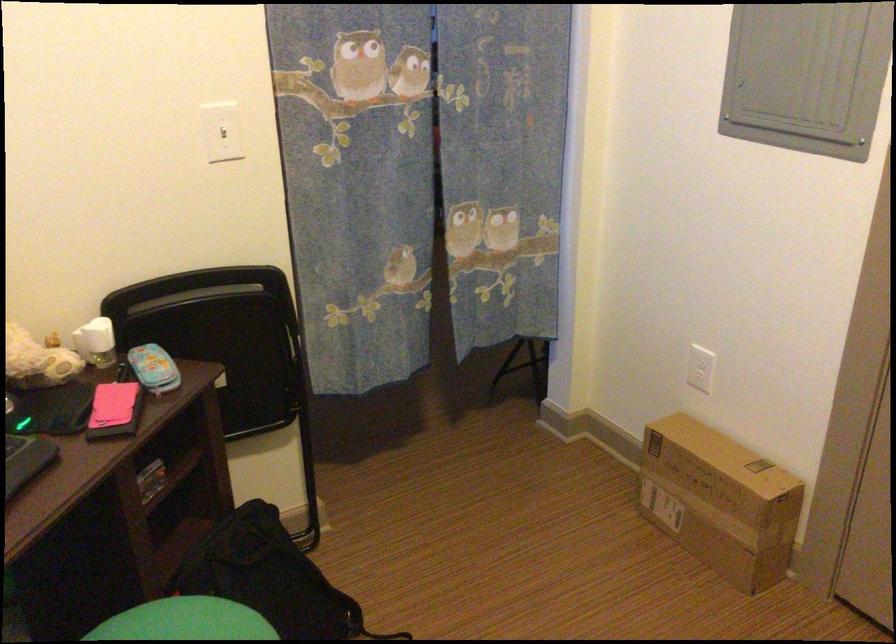
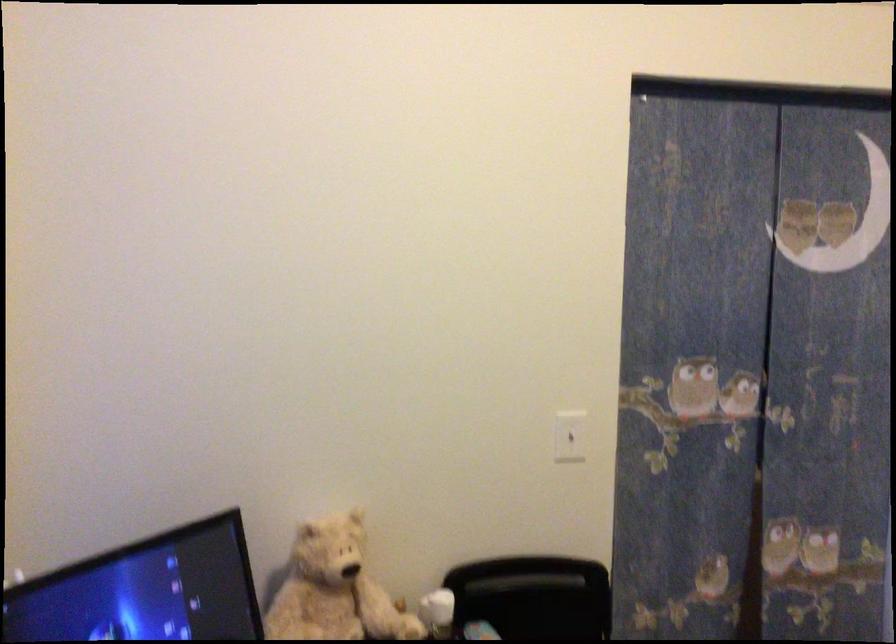
In a continuous first-person perspective shot, in which direction is the camera moving?

The cameraman moved toward left, backward.